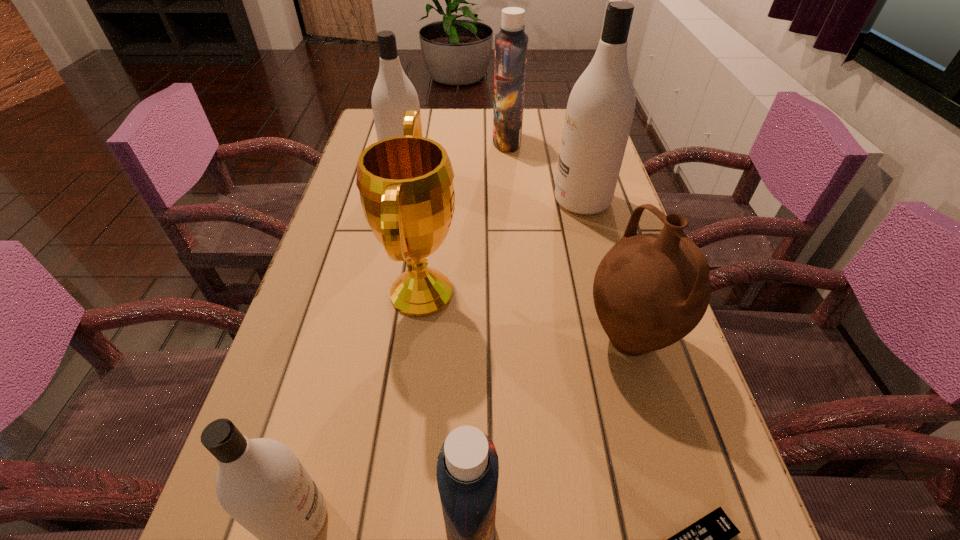
You are a GUI agent. You are given a task and a screenshot of the screen. Output one action in this format:
    pyautogui.click(x=<x>, y=<y>)
    Task: Click on the free space at the far edge of the desktop
    Image resolution: width=960 pixels, height=540 pixels.
    Given the screenshot: What is the action you would take?
    pyautogui.click(x=477, y=110)

Where is `free point at the left edge`? This screenshot has width=960, height=540. free point at the left edge is located at coordinates (357, 256).

Locate an element on the screen. The image size is (960, 540). free point at the right edge is located at coordinates (612, 228).

This screenshot has height=540, width=960. In the image, there is a desktop. Identify the location of vacant region at the far right corner. (557, 117).

Locate an element on the screen. The image size is (960, 540). empty space that is in between the tallest object and the second shampoo from right to left is located at coordinates (544, 171).

Image resolution: width=960 pixels, height=540 pixels. I want to click on free space that is in between the gold award and the rightmost white shampoo, so click(502, 247).

Find the location of `free space that is in between the pitcher and the second biggest white shampoo`. free space that is in between the pitcher and the second biggest white shampoo is located at coordinates (517, 256).

Identify which object is the second nearest to the shortest object. Please provide its 2D coordinates. Your answer should be formatted as a tuple, i.e. [(x, y)], where the tuple contains the x and y coordinates of a point satisfying the conditions above.

[(650, 290)]

Select which object is the third closest to the bigger blue shampoo. Please provide its 2D coordinates. Your answer should be formatted as a tuple, i.e. [(x, y)], where the tuple contains the x and y coordinates of a point satisfying the conditions above.

[(406, 188)]

Point out which shampoo is positioned as the second nearest to the tallest shampoo. Please provide its 2D coordinates. Your answer should be formatted as a tuple, i.e. [(x, y)], where the tuple contains the x and y coordinates of a point satisfying the conditions above.

[(393, 93)]